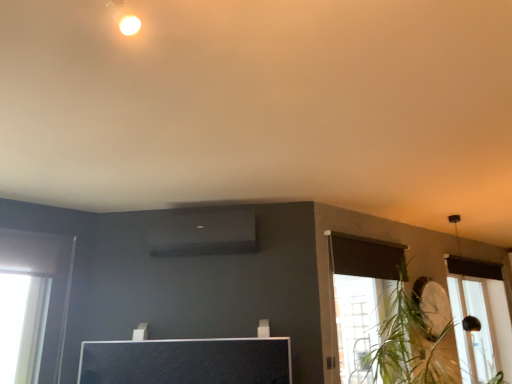
Question: In the image, is green leafy plant at right on the left side or the right side of transparent glass window at lower right?

Choices:
 (A) right
 (B) left

Answer: (B)

Question: Is green leafy plant at right in front of or behind transparent glass window at lower right in the image?

Choices:
 (A) behind
 (B) front

Answer: (B)

Question: In terms of height, does green leafy plant at right look taller or shorter compared to transparent glass window at lower right?

Choices:
 (A) tall
 (B) short

Answer: (B)

Question: Is transparent glass window at lower right wider or thinner than green leafy plant at right?

Choices:
 (A) wide
 (B) thin

Answer: (B)

Question: From their relative heights in the image, would you say transparent glass window at lower right is taller or shorter than green leafy plant at right?

Choices:
 (A) tall
 (B) short

Answer: (A)

Question: In the image, is transparent glass window at lower right positioned in front of or behind green leafy plant at right?

Choices:
 (A) behind
 (B) front

Answer: (A)

Question: Is point (456, 317) closer or farther from the camera than point (430, 309)?

Choices:
 (A) closer
 (B) farther

Answer: (B)